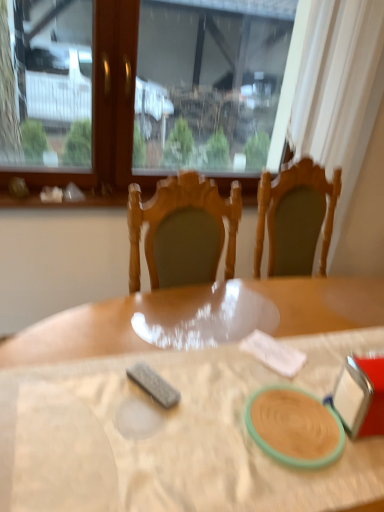
Question: Should I look upward or downward to see wooden table at center?

Choices:
 (A) down
 (B) up

Answer: (A)

Question: From the image's perspective, is matte green plate at center on top of wooden table at center?

Choices:
 (A) no
 (B) yes

Answer: (B)

Question: Is matte green plate at center smaller than wooden table at center?

Choices:
 (A) yes
 (B) no

Answer: (A)

Question: Considering the relative sizes of matte green plate at center and wooden table at center in the image provided, is matte green plate at center bigger than wooden table at center?

Choices:
 (A) yes
 (B) no

Answer: (B)

Question: Does matte green plate at center come in front of wooden table at center?

Choices:
 (A) no
 (B) yes

Answer: (A)

Question: Is matte green plate at center at the right side of wooden table at center?

Choices:
 (A) no
 (B) yes

Answer: (A)

Question: From a real-world perspective, is matte green plate at center below wooden table at center?

Choices:
 (A) no
 (B) yes

Answer: (A)

Question: Is transparent glass window at upper center positioned in front of matte green plate at center?

Choices:
 (A) yes
 (B) no

Answer: (B)

Question: Would you say matte green plate at center is part of transparent glass window at upper center's contents?

Choices:
 (A) yes
 (B) no

Answer: (B)

Question: Is the depth of transparent glass window at upper center greater than that of matte green plate at center?

Choices:
 (A) yes
 (B) no

Answer: (A)

Question: Considering the relative positions of transparent glass window at upper center and matte green plate at center in the image provided, is transparent glass window at upper center to the left of matte green plate at center from the viewer's perspective?

Choices:
 (A) yes
 (B) no

Answer: (A)

Question: Considering the relative positions of transparent glass window at upper center and matte green plate at center in the image provided, is transparent glass window at upper center to the right of matte green plate at center from the viewer's perspective?

Choices:
 (A) no
 (B) yes

Answer: (A)

Question: Is transparent glass window at upper center completely or partially outside of matte green plate at center?

Choices:
 (A) yes
 (B) no

Answer: (A)

Question: Considering the relative sizes of matte green plate at center and transparent glass window at upper center in the image provided, is matte green plate at center taller than transparent glass window at upper center?

Choices:
 (A) no
 (B) yes

Answer: (A)